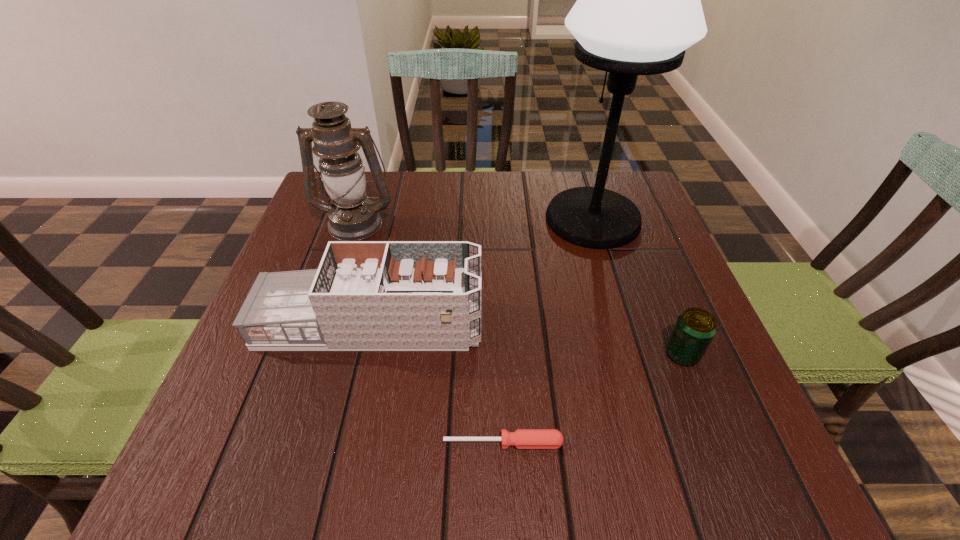
Locate an element on the screen. This screenshot has width=960, height=540. free space between the beer can and the third tallest object is located at coordinates (526, 339).

The height and width of the screenshot is (540, 960). I want to click on free spot between the dollhouse and the table lamp, so click(482, 272).

Locate an element on the screen. empty location between the beer can and the tallest object is located at coordinates (637, 287).

The image size is (960, 540). What are the coordinates of `free space between the third shortest object and the fourth tallest object` in the screenshot? It's located at (526, 339).

This screenshot has height=540, width=960. I want to click on vacant region between the beer can and the dollhouse, so click(x=526, y=339).

Locate which object ranks in proximity to the dollhouse. Please provide its 2D coordinates. Your answer should be formatted as a tuple, i.e. [(x, y)], where the tuple contains the x and y coordinates of a point satisfying the conditions above.

[(522, 438)]

Image resolution: width=960 pixels, height=540 pixels. Identify the location of object that is the third closest one to the beer can. (365, 295).

This screenshot has height=540, width=960. What are the coordinates of `vacant point that satisfies the following two spatial constraints: 1. at the entrance of the shortest object; 2. on the left side of the third tallest object` in the screenshot? It's located at (344, 443).

I want to click on free space that satisfies the following two spatial constraints: 1. on the back side of the tallest object; 2. on the left side of the shortest object, so click(494, 219).